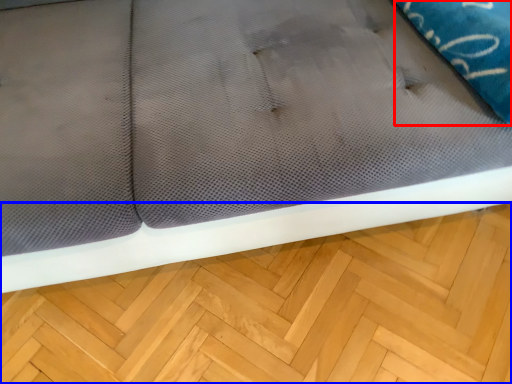
Question: Which object appears farthest to the camera in this image, pillow (highlighted by a red box) or hardwood (highlighted by a blue box)?

Choices:
 (A) pillow
 (B) hardwood

Answer: (B)